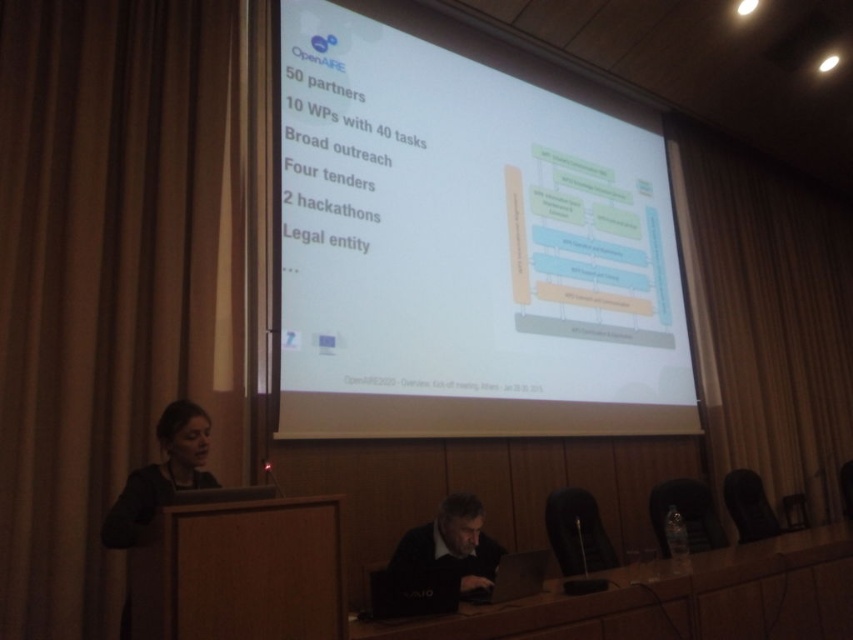
You are standing in the conference room and want to present your slides. The projector is placed at the back of the room. Can you reach the white matte projector screen at center from your current position without moving closer than 10 feet?

The white matte projector screen at center is 11.69 feet from viewer. Since you are standing at the back, which is likely beyond 10 feet away, you can reach it without moving closer than 10 feet.

Based on the photo, you are setting up for a presentation and need to adjust the lighting. You have a spotlight that needs to be placed between the brown fabric curtain at left and the black fabric at lower left. Which fabric should the spotlight be placed closer to if you want it to illuminate the area between them equally?

The spotlight should be placed closer to the black fabric at lower left because the brown fabric curtain at left is positioned on the left side of the black fabric at lower left, meaning the distance between them is such that placing the spotlight closer to the black fabric would balance the illumination between both fabrics.